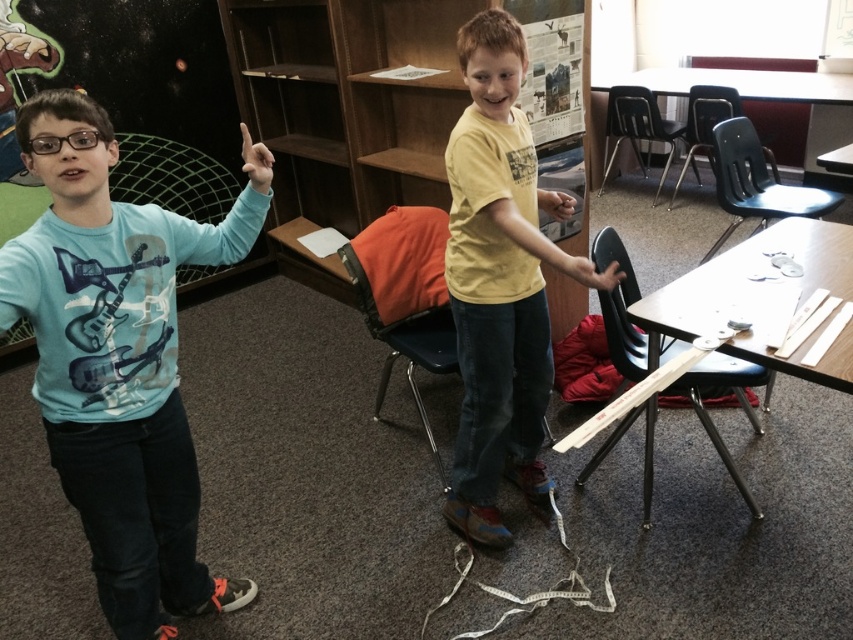
Question: Which point appears closest to the camera in this image?

Choices:
 (A) (242, 147)
 (B) (384, 160)

Answer: (A)

Question: Observing the image, what is the correct spatial positioning of yellow matte shirt at center in reference to matte yellow hand at center?

Choices:
 (A) left
 (B) right

Answer: (A)

Question: Which point is closer to the camera taking this photo?

Choices:
 (A) (548, 211)
 (B) (305, 58)

Answer: (A)

Question: Is smooth skin hand at center to the left of matte skin hand at upper center from the viewer's perspective?

Choices:
 (A) yes
 (B) no

Answer: (B)

Question: Does matte blue shirt at left appear on the right side of wooden bookshelf at center?

Choices:
 (A) no
 (B) yes

Answer: (A)

Question: Considering the real-world distances, which object is closest to the matte yellow hand at center?

Choices:
 (A) matte skin hand at upper center
 (B) matte blue shirt at left
 (C) smooth skin hand at center
 (D) yellow matte shirt at center

Answer: (C)